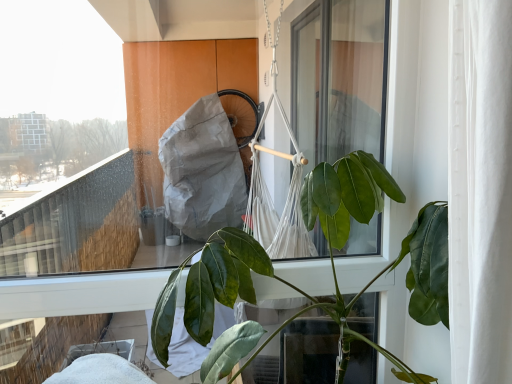
Question: Can you confirm if transparent glass window at center is bigger than green glossy leafy plant at center?

Choices:
 (A) yes
 (B) no

Answer: (B)

Question: Does transparent glass window at center lie behind green glossy leafy plant at center?

Choices:
 (A) yes
 (B) no

Answer: (A)

Question: From a real-world perspective, is transparent glass window at center positioned over green glossy leafy plant at center based on gravity?

Choices:
 (A) no
 (B) yes

Answer: (B)

Question: Is transparent glass window at center closer to the viewer compared to green glossy leafy plant at center?

Choices:
 (A) yes
 (B) no

Answer: (B)

Question: Does transparent glass window at center contain green glossy leafy plant at center?

Choices:
 (A) no
 (B) yes

Answer: (A)

Question: Is transparent glass window at center far away from green glossy leafy plant at center?

Choices:
 (A) no
 (B) yes

Answer: (B)

Question: Can you confirm if green glossy leafy plant at center is taller than transparent glass window at center?

Choices:
 (A) yes
 (B) no

Answer: (B)

Question: Can you confirm if green glossy leafy plant at center is smaller than transparent glass window at center?

Choices:
 (A) yes
 (B) no

Answer: (B)

Question: Is green glossy leafy plant at center further to the viewer compared to transparent glass window at center?

Choices:
 (A) no
 (B) yes

Answer: (A)

Question: Would you say green glossy leafy plant at center contains transparent glass window at center?

Choices:
 (A) no
 (B) yes

Answer: (A)

Question: Is green glossy leafy plant at center completely or partially outside of transparent glass window at center?

Choices:
 (A) no
 (B) yes

Answer: (B)

Question: From a real-world perspective, does green glossy leafy plant at center sit lower than transparent glass window at center?

Choices:
 (A) no
 (B) yes

Answer: (B)

Question: In terms of width, does transparent glass window at center look wider or thinner when compared to green glossy leafy plant at center?

Choices:
 (A) thin
 (B) wide

Answer: (A)